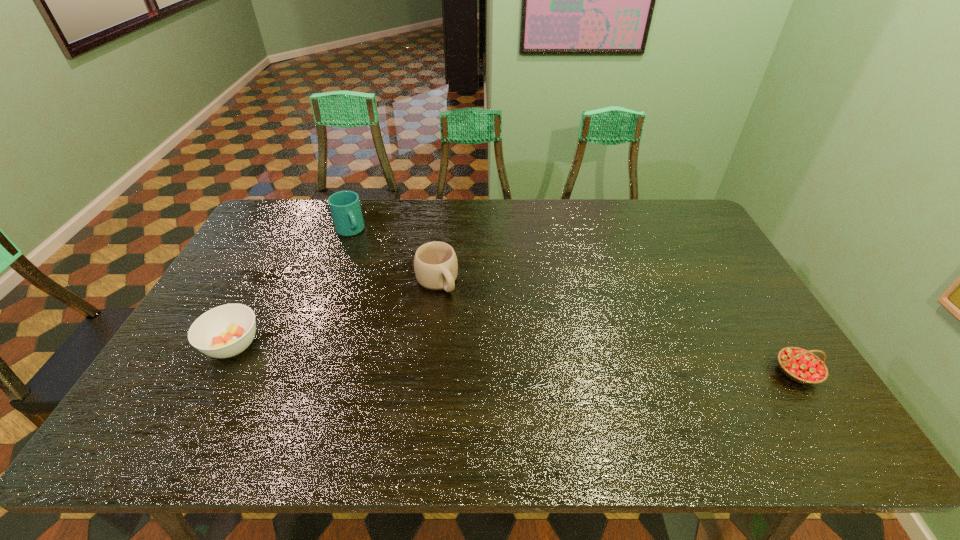
Identify the location of vacant space that's between the third shortest object and the soup bowl. (335, 313).

Where is `vacant area between the rightmost object and the second tallest object`? This screenshot has width=960, height=540. vacant area between the rightmost object and the second tallest object is located at coordinates (616, 327).

The width and height of the screenshot is (960, 540). Identify the location of free space between the second tallest object and the farthest object. (394, 256).

You are a GUI agent. You are given a task and a screenshot of the screen. Output one action in this format:
    pyautogui.click(x=<x>, y=<y>)
    Task: Click on the vacant space that is in between the second farthest object and the leftmost object
    
    Given the screenshot: What is the action you would take?
    pyautogui.click(x=335, y=313)

I want to click on the third closest object to the rightmost object, so click(227, 330).

Choose which object is the nearest neighbor to the leftmost object. Please provide its 2D coordinates. Your answer should be formatted as a tuple, i.e. [(x, y)], where the tuple contains the x and y coordinates of a point satisfying the conditions above.

[(345, 208)]

The image size is (960, 540). In order to click on vacant space that satisfies the following two spatial constraints: 1. on the back side of the soup bowl; 2. on the right side of the farthest object in this screenshot , I will do point(294,231).

At what (x,y) coordinates should I click in order to perform the action: click on vacant position in the image that satisfies the following two spatial constraints: 1. on the back side of the tallest object; 2. on the left side of the soup bowl. Please return your answer as a coordinate pair (x, y). Looking at the image, I should click on (x=294, y=231).

In order to click on vacant area that satisfies the following two spatial constraints: 1. on the front side of the second object from left to right; 2. on the right side of the mug in this screenshot , I will do `click(331, 281)`.